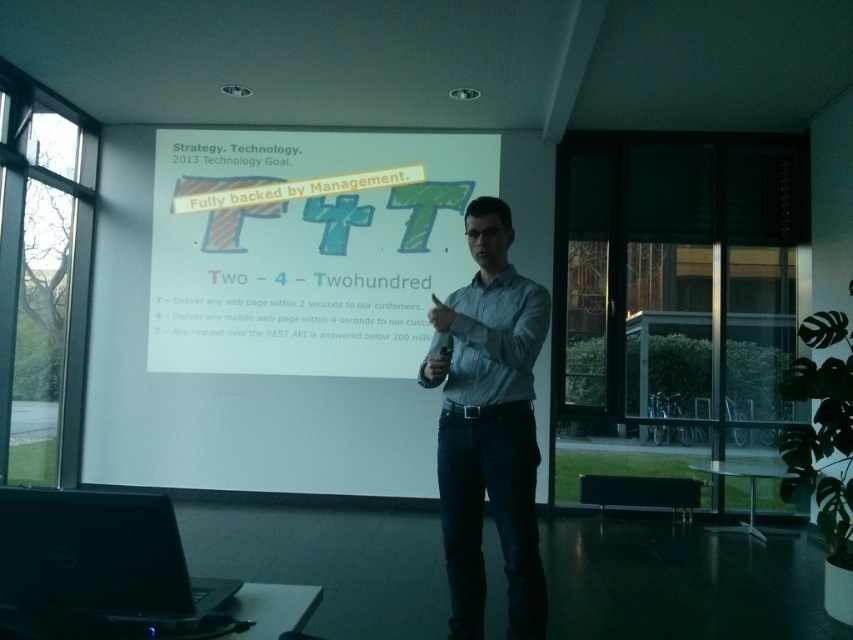
Question: Which object appears farthest from the camera in this image?

Choices:
 (A) white matte projection screen at center
 (B) denim jeans at center

Answer: (A)

Question: Which point appears farthest from the camera in this image?

Choices:
 (A) (196, 179)
 (B) (442, 499)

Answer: (A)

Question: Does white matte projection screen at center appear under denim jeans at center?

Choices:
 (A) yes
 (B) no

Answer: (B)

Question: Can you confirm if white matte projection screen at center is positioned below denim jeans at center?

Choices:
 (A) yes
 (B) no

Answer: (B)

Question: Is white matte projection screen at center thinner than denim jeans at center?

Choices:
 (A) yes
 (B) no

Answer: (B)